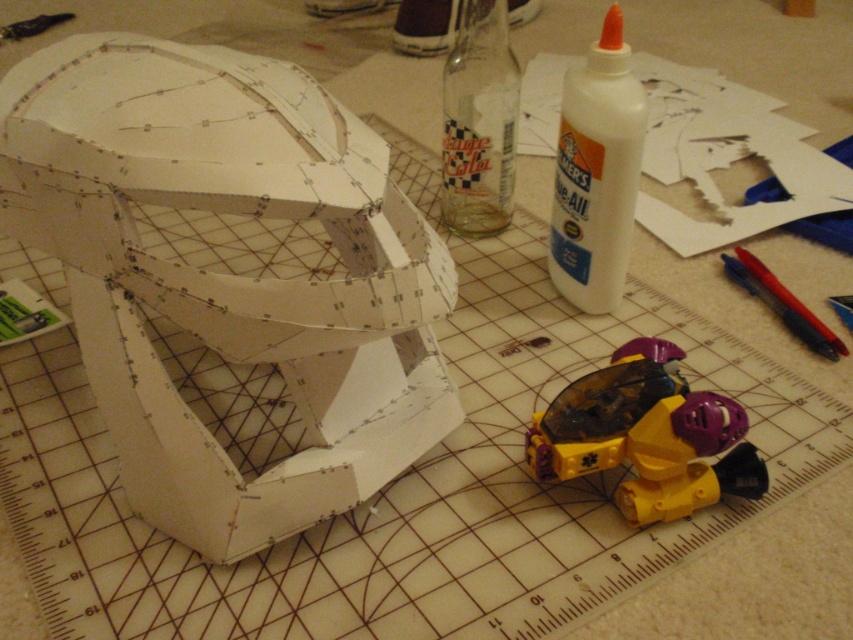
You are trying to assemble the paper model and need to place the white paper helmet at upper left and the yellow plastic toy at lower right. According to the workspace layout, which object is positioned more to the left?

The white paper helmet at upper left is positioned more to the left than the yellow plastic toy at lower right.

You are trying to decide which item to place in a storage box that has a height limit of 10 cm. The white paper helmet at upper left and the yellow plastic toy at lower right are both candidates. Based on their heights, which one is more likely to exceed the height limit?

The white paper helmet at upper left is taller than the yellow plastic toy at lower right, so it is more likely to exceed the 10 cm height limit.